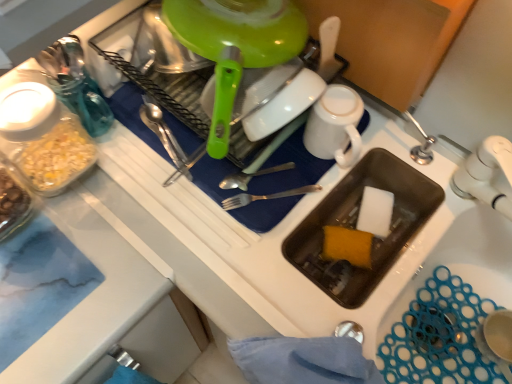
Question: From a real-world perspective, is shiny metal spoon at center above or below white sponge at sink bottom, the 2th food viewed from the left?

Choices:
 (A) below
 (B) above

Answer: (B)

Question: Would you say shiny metal spoon at center is to the left or to the right of white sponge at sink bottom, arranged as the first food when viewed from the right, in the picture?

Choices:
 (A) left
 (B) right

Answer: (A)

Question: Which of these objects is positioned farthest from the yellow sponge at sink bottom, which appears as the 2th food when viewed from the right?

Choices:
 (A) white matte mug at upper center
 (B) shiny metal spoon at center
 (C) white sponge at sink bottom, arranged as the first food when viewed from the right
 (D) silver metallic fork at center
 (E) green plastic kettle at upper center

Answer: (B)

Question: Which of these objects is positioned closest to the shiny metal spoon at center?

Choices:
 (A) yellow sponge at sink bottom, marked as the 1th food in a left-to-right arrangement
 (B) silver metallic fork at center
 (C) white sponge at sink bottom, the 2th food viewed from the left
 (D) green plastic kettle at upper center
 (E) white matte mug at upper center

Answer: (D)